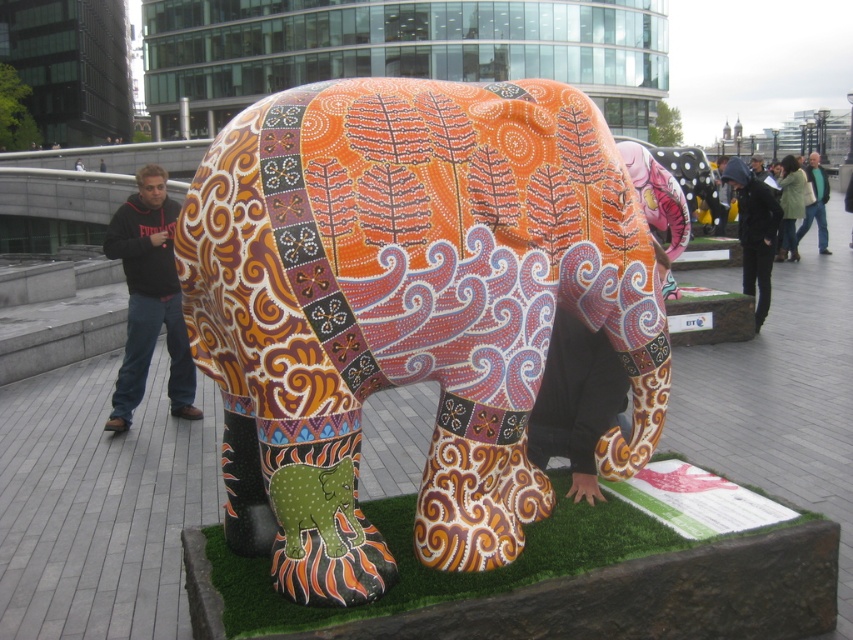
Question: Which object appears closest to the camera in this image?

Choices:
 (A) black fleece jacket at left
 (B) black fabric jacket at upper right

Answer: (A)

Question: Is black fleece jacket at left to the right of black fabric jacket at upper right from the viewer's perspective?

Choices:
 (A) yes
 (B) no

Answer: (B)

Question: Which point is farther to the camera?

Choices:
 (A) (705, 163)
 (B) (161, 259)
 (C) (669, 180)
 (D) (758, 289)

Answer: (A)

Question: Does matte painted elephant at center appear on the right side of jeans at center?

Choices:
 (A) yes
 (B) no

Answer: (B)

Question: Which of the following is the closest to the observer?

Choices:
 (A) matte painted elephant at center
 (B) painted ceramic elephant at center
 (C) black fabric jacket at upper right
 (D) green artificial turf at center

Answer: (D)

Question: Does painted ceramic elephant at center have a smaller size compared to polka dot fabric elephant at upper right?

Choices:
 (A) yes
 (B) no

Answer: (A)